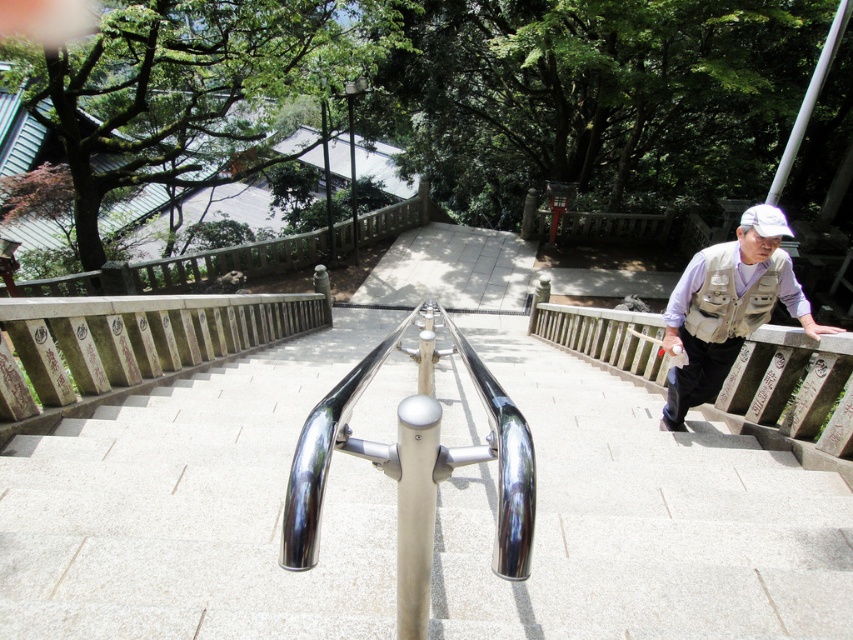
Question: Which point is closer to the camera?

Choices:
 (A) (715, 288)
 (B) (759, 212)

Answer: (B)

Question: Which object is the closest to the light brown vest at right?

Choices:
 (A) white matte baseball hat at upper right
 (B) wooden at right
 (C) polished metal handrail at center

Answer: (B)

Question: Is wooden at right to the right of light brown vest at right from the viewer's perspective?

Choices:
 (A) no
 (B) yes

Answer: (B)

Question: Can you confirm if polished metal handrail at center is positioned to the right of white matte baseball hat at upper right?

Choices:
 (A) yes
 (B) no

Answer: (B)

Question: Which object is positioned closest to the wooden at right?

Choices:
 (A) light brown vest at right
 (B) polished metal handrail at center
 (C) white matte baseball hat at upper right

Answer: (A)

Question: Does polished metal handrail at center come behind wooden at right?

Choices:
 (A) yes
 (B) no

Answer: (B)